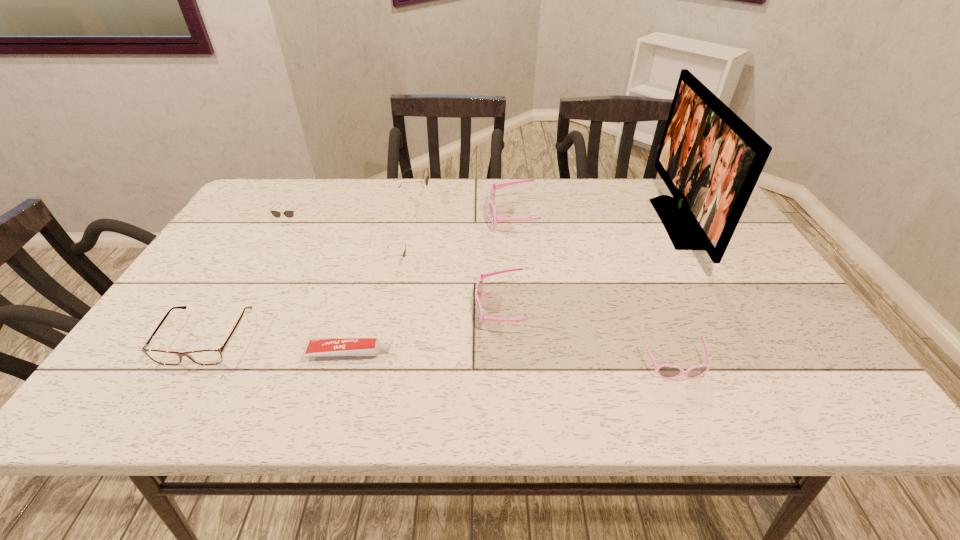
I want to click on free space between the spectacles and the farthest pink sunglasses, so click(x=359, y=278).

Image resolution: width=960 pixels, height=540 pixels. Identify the location of vacant space that is in between the second smallest pink sunglasses and the tallest sunglasses. [x=458, y=253].

The width and height of the screenshot is (960, 540). What are the coordinates of `object that is the seventh closest to the nearest pink sunglasses` in the screenshot? It's located at (211, 356).

This screenshot has height=540, width=960. I want to click on object that stands as the sixth closest to the second farthest black sunglasses, so click(479, 287).

Identify which sunglasses is the fourth nearest to the eighth shortest object. Please provide its 2D coordinates. Your answer should be formatted as a tuple, i.e. [(x, y)], where the tuple contains the x and y coordinates of a point satisfying the conditions above.

[(479, 287)]

Locate which sunglasses ranks second in proximity to the farthest black sunglasses. Please provide its 2D coordinates. Your answer should be formatted as a tuple, i.e. [(x, y)], where the tuple contains the x and y coordinates of a point satisfying the conditions above.

[(491, 199)]

Find the location of a particular element. the closest black sunglasses to the farthest black sunglasses is located at coordinates (404, 253).

Locate which black sunglasses is the second closest to the rightmost sunglasses. Please provide its 2D coordinates. Your answer should be formatted as a tuple, i.e. [(x, y)], where the tuple contains the x and y coordinates of a point satisfying the conditions above.

[(426, 181)]

What are the coordinates of `the third closest pink sunglasses to the leftmost sunglasses` in the screenshot? It's located at [x=666, y=371].

Where is `pink sunglasses that is the second nearest to the biggest pink sunglasses`? pink sunglasses that is the second nearest to the biggest pink sunglasses is located at coordinates (666, 371).